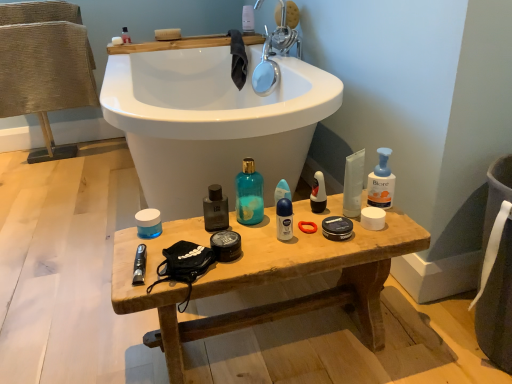
This screenshot has width=512, height=384. In order to click on empty space that is to the right of matte black bottle at center, which appears as the 6th toiletry when viewed from the back in this screenshot , I will do `click(276, 233)`.